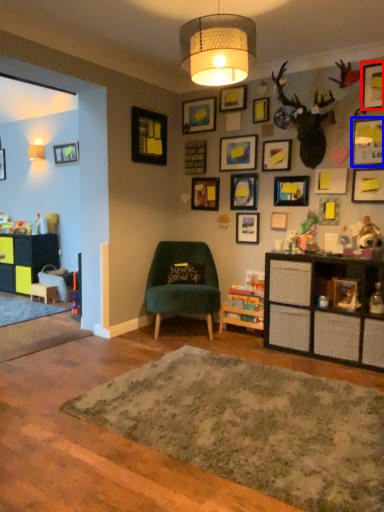
Question: Which object appears farthest to the camera in this image, picture frame (highlighted by a red box) or picture frame (highlighted by a blue box)?

Choices:
 (A) picture frame
 (B) picture frame

Answer: (A)